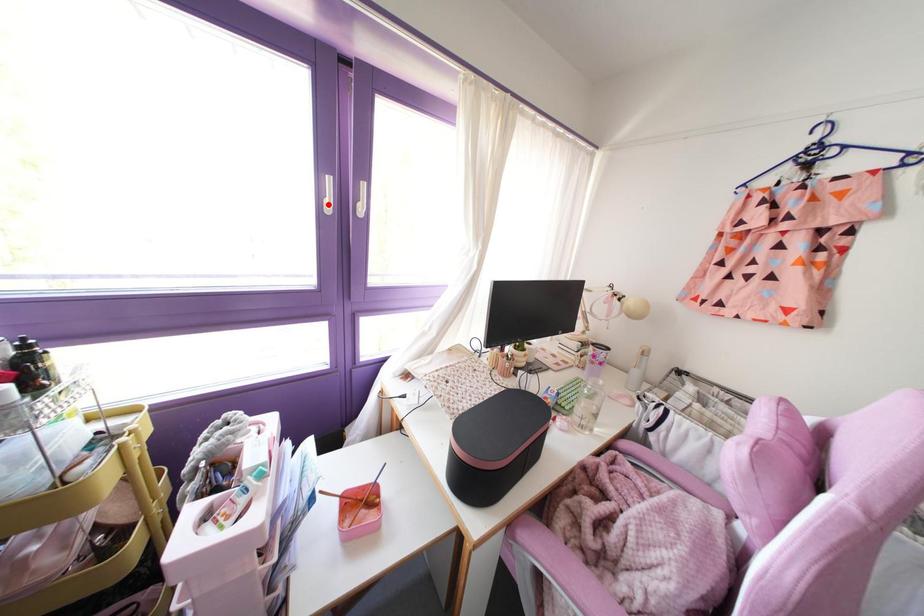
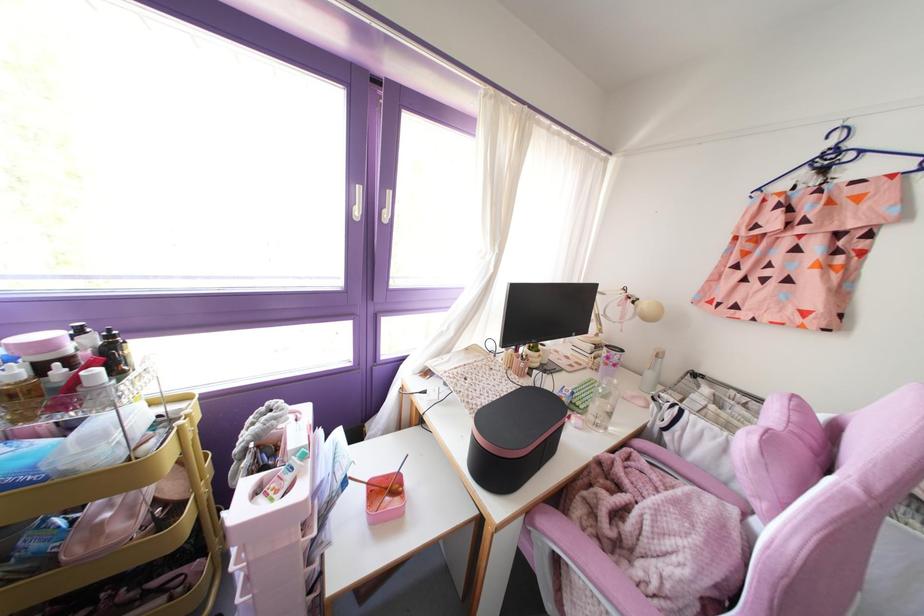
Where in the second image is the point corresponding to the highlighted location from the first image?

(357, 212)